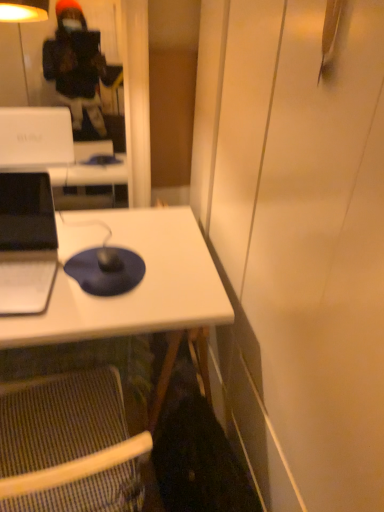
This screenshot has width=384, height=512. What are the coordinates of `vacant space in between matte black laptop at left and blue matte mousepad at center` in the screenshot? It's located at click(81, 303).